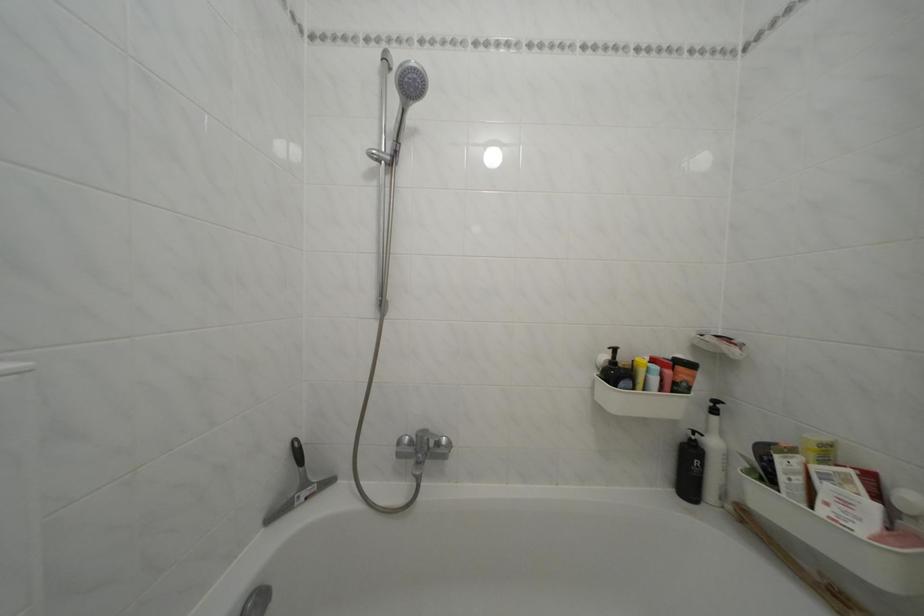
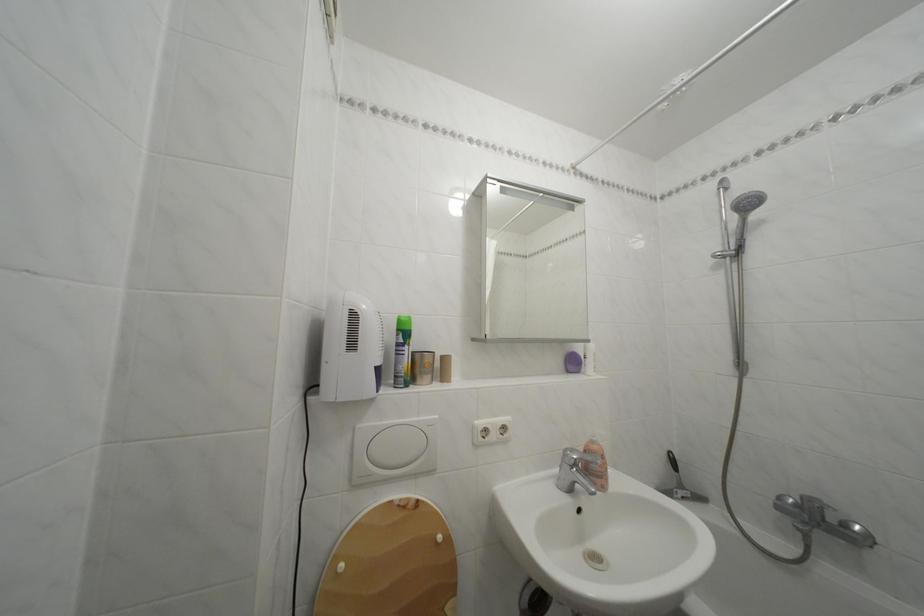
Where in the second image is the point corresponding to point 398,74 from the first image?

(736, 195)